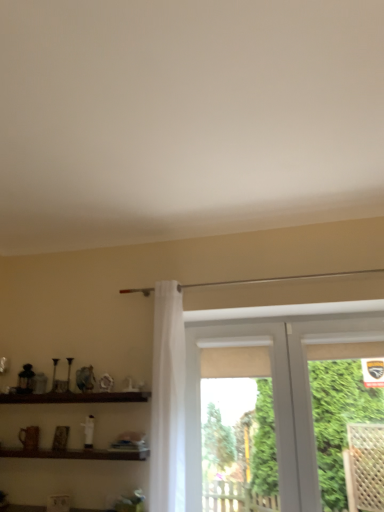
Question: Is green leafy plant at right located outside white plastic window at center?

Choices:
 (A) yes
 (B) no

Answer: (B)

Question: From the image's perspective, is green leafy plant at right on top of white plastic window at center?

Choices:
 (A) yes
 (B) no

Answer: (A)

Question: Does green leafy plant at right have a lesser width compared to white plastic window at center?

Choices:
 (A) no
 (B) yes

Answer: (A)

Question: Does green leafy plant at right have a greater width compared to white plastic window at center?

Choices:
 (A) no
 (B) yes

Answer: (B)

Question: Is green leafy plant at right placed right next to white plastic window at center?

Choices:
 (A) no
 (B) yes

Answer: (A)

Question: Is green leafy plant at right behind white plastic window at center?

Choices:
 (A) yes
 (B) no

Answer: (B)

Question: Is brown wooden shelf at lower left, positioned as the second shelf in bottom-to-top order, completely or partially inside brown wooden shelf at lower left, the second shelf from the top?

Choices:
 (A) no
 (B) yes

Answer: (A)

Question: From the image's perspective, is brown wooden shelf at lower left, the second shelf from the top, above brown wooden shelf at lower left, positioned as the second shelf in bottom-to-top order?

Choices:
 (A) yes
 (B) no

Answer: (B)

Question: From a real-world perspective, is brown wooden shelf at lower left, positioned as the 1th shelf in bottom-to-top order, physically below brown wooden shelf at lower left, positioned as the second shelf in bottom-to-top order?

Choices:
 (A) no
 (B) yes

Answer: (B)

Question: Is brown wooden shelf at lower left, positioned as the 1th shelf in bottom-to-top order, behind brown wooden shelf at lower left, placed as the first shelf when sorted from top to bottom?

Choices:
 (A) no
 (B) yes

Answer: (A)

Question: From the image's perspective, is brown wooden shelf at lower left, the second shelf from the top, under brown wooden shelf at lower left, positioned as the second shelf in bottom-to-top order?

Choices:
 (A) no
 (B) yes

Answer: (B)

Question: Can you confirm if brown wooden shelf at lower left, positioned as the 1th shelf in bottom-to-top order, is smaller than brown wooden shelf at lower left, placed as the first shelf when sorted from top to bottom?

Choices:
 (A) yes
 (B) no

Answer: (A)

Question: Is brown wooden shelf at lower left, positioned as the second shelf in bottom-to-top order, surrounded by white plastic window at center?

Choices:
 (A) yes
 (B) no

Answer: (B)